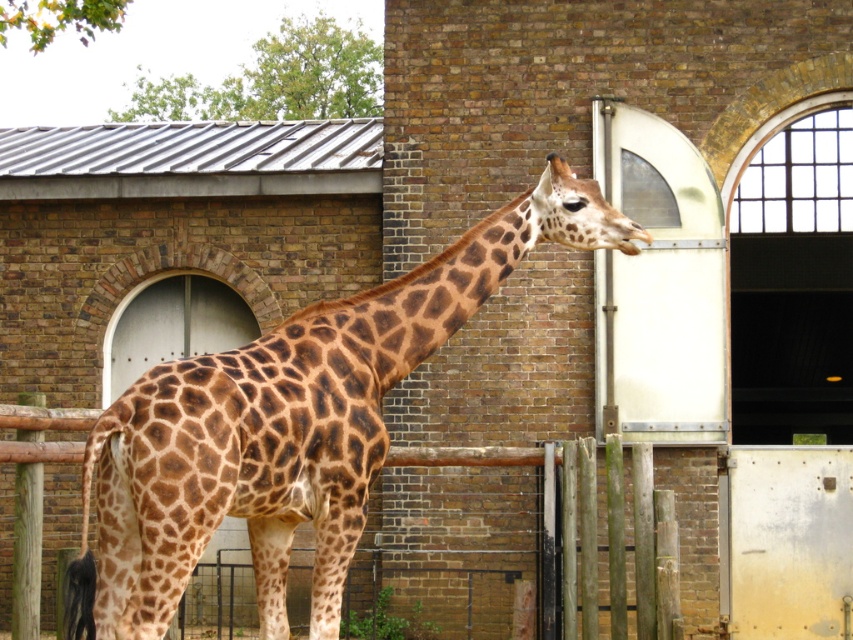
Question: From the image, what is the correct spatial relationship of brown spotted giraffe at center in relation to wooden at center?

Choices:
 (A) below
 (B) above

Answer: (B)

Question: Can you confirm if brown spotted giraffe at center is positioned below wooden at center?

Choices:
 (A) no
 (B) yes

Answer: (A)

Question: Which point appears farthest from the camera in this image?

Choices:
 (A) (553, 188)
 (B) (538, 465)

Answer: (B)

Question: Among these objects, which one is farthest from the camera?

Choices:
 (A) wooden at center
 (B) brown spotted giraffe at center

Answer: (A)

Question: Is brown spotted giraffe at center to the right of wooden at center from the viewer's perspective?

Choices:
 (A) yes
 (B) no

Answer: (B)